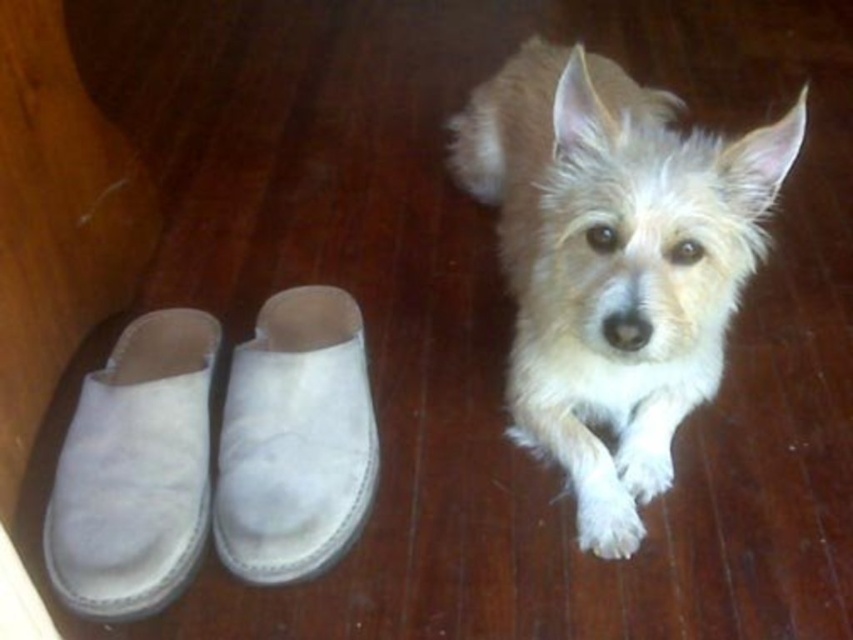
Question: Which of the following is the closest to the observer?

Choices:
 (A) suede slipper at center
 (B) suede slipper at lower left

Answer: (B)

Question: Which object is farther from the camera taking this photo?

Choices:
 (A) suede slipper at lower left
 (B) suede slipper at center
 (C) white fluffy dog at center

Answer: (B)

Question: Which of the following is the farthest from the observer?

Choices:
 (A) suede slipper at center
 (B) suede slipper at lower left
 (C) white fluffy dog at center

Answer: (A)

Question: Is suede slipper at lower left to the left of suede slipper at center from the viewer's perspective?

Choices:
 (A) no
 (B) yes

Answer: (B)

Question: In this image, where is suede slipper at lower left located relative to suede slipper at center?

Choices:
 (A) above
 (B) below

Answer: (B)

Question: Does white fluffy dog at center come in front of suede slipper at lower left?

Choices:
 (A) yes
 (B) no

Answer: (A)